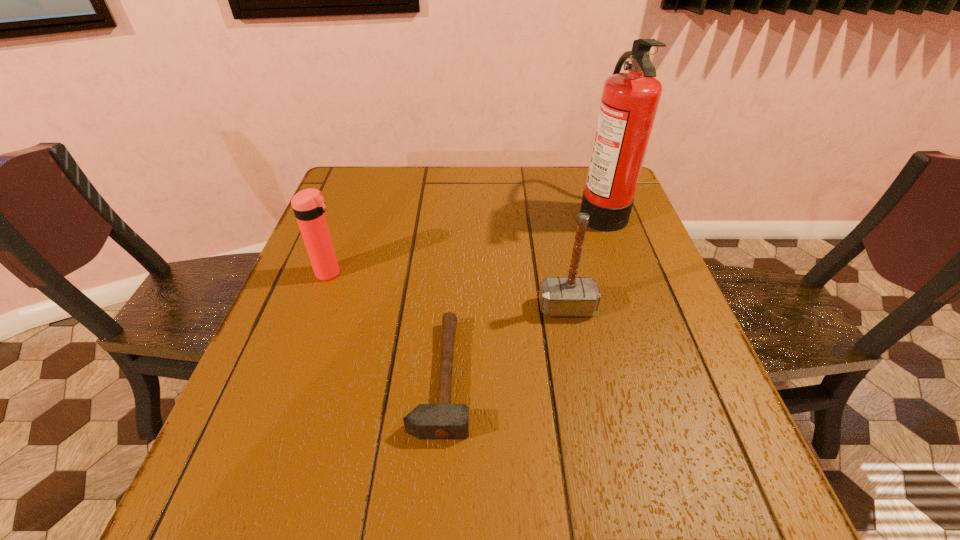
Image resolution: width=960 pixels, height=540 pixels. Find the location of `vacant space located 0.330m on the front-facing side of the tallest object`. vacant space located 0.330m on the front-facing side of the tallest object is located at coordinates tap(461, 211).

Where is `blank area located 0.260m on the striking surface of the right hammer`? This screenshot has height=540, width=960. blank area located 0.260m on the striking surface of the right hammer is located at coordinates (591, 433).

Identify the location of free space located 0.190m on the right of the leftmost object. This screenshot has height=540, width=960. (423, 273).

In order to click on vacant region located on the striking surface of the nearest object in this screenshot , I will do `click(668, 376)`.

Locate an element on the screen. object at the far edge is located at coordinates (629, 103).

Image resolution: width=960 pixels, height=540 pixels. Find the location of `object present at the left edge`. object present at the left edge is located at coordinates (308, 205).

You are a GUI agent. You are given a task and a screenshot of the screen. Output one action in this format:
    pyautogui.click(x=<x>, y=<y>)
    Task: Click on the object at the right edge
    The width and height of the screenshot is (960, 540).
    Given the screenshot: What is the action you would take?
    pyautogui.click(x=629, y=103)

This screenshot has width=960, height=540. In order to click on object at the far right corner in this screenshot , I will do `click(629, 103)`.

In the image, there is a desktop. What are the coordinates of `vacant space at the far edge` in the screenshot? It's located at (416, 170).

In the image, there is a desktop. Where is `free space at the near edge`? free space at the near edge is located at coordinates (564, 520).